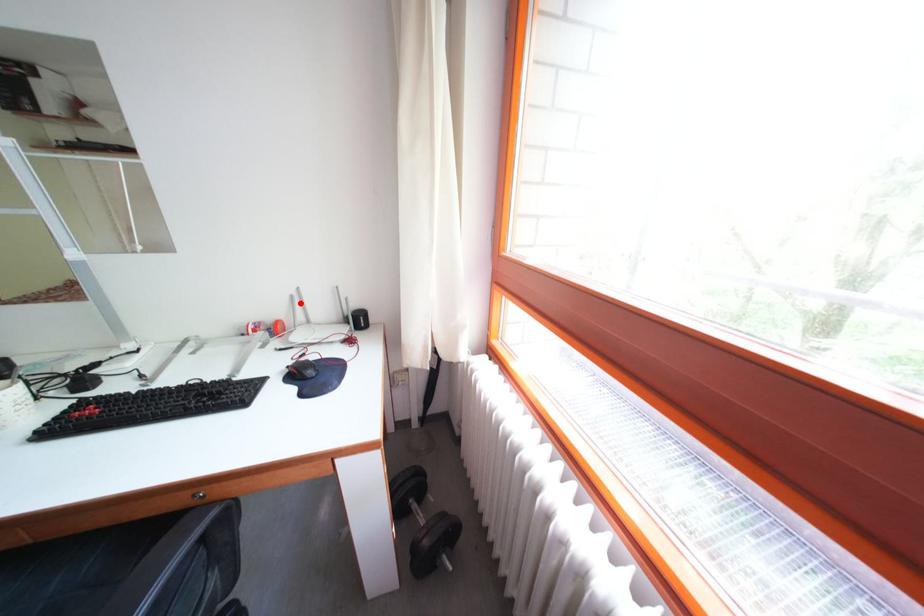
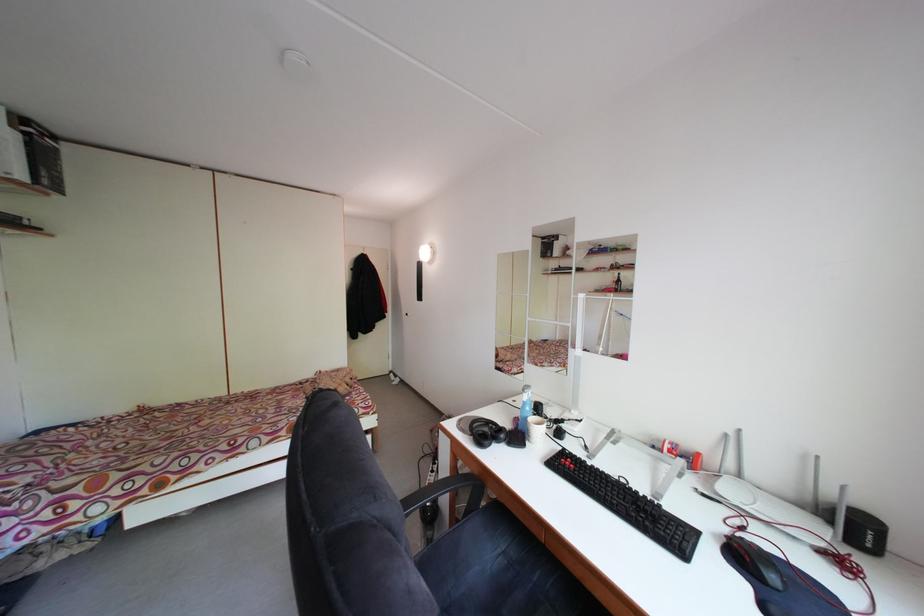
Locate, in the second image, the point that corresponds to the highlighted location in the first image.

(735, 442)